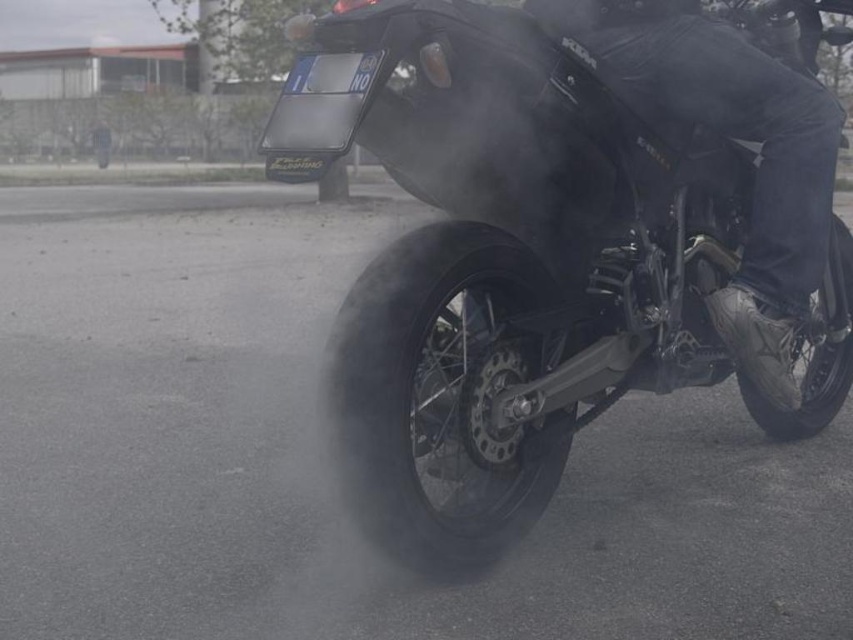
You are a photographer trying to capture the black matte motorcycle at center and the black rubber tire at lower right in a single frame. Based on their sizes, do you think you can fit both objects into the camera frame without moving the camera?

The black matte motorcycle at center might be wider than black rubber tire at lower right, so there is a possibility that both objects can fit into the camera frame without moving it, but it depends on the exact width of the motorcycle compared to the tire.

From the picture: You are a photographer trying to capture the black matte motorcycle at center and the black rubber tire at lower right in a single frame. Since you want to ensure both are visible, does the motorcycle at center block the view of the tire at lower right due to its height?

The black matte motorcycle at center is taller than the black rubber tire at lower right, so it might block the view of the tire depending on the angle and positioning. To ensure both are visible, adjust your camera angle to capture both the motorcycle and tire without obstruction.